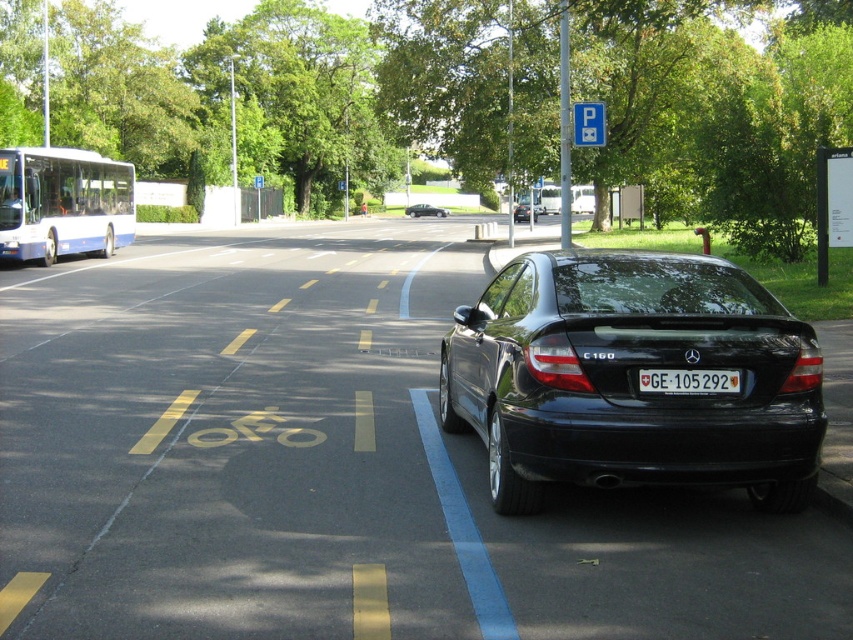
You are a delivery driver who needs to park your car in a parking spot. You see a black glossy car at center and a white plastic license plate at center. Which object is bigger in size?

The black glossy car at center is larger in size compared to the white plastic license plate at center.

You are a pedestrian standing on the sidewalk and want to cross the road to reach the bus. You see the black glossy car at center and the shiny black sedan at center. Which one is closer to the right side of the road?

The black glossy car at center is closer to the right side of the road because it is positioned to the right of the shiny black sedan at center.

Consider the image. You are a delivery driver who needs to park your van in the parking area near the black glossy car at center and the black glossy sedan at center. Based on the scene, which one is positioned lower in the image?

The black glossy car at center is positioned lower than the black glossy sedan at center in the image.